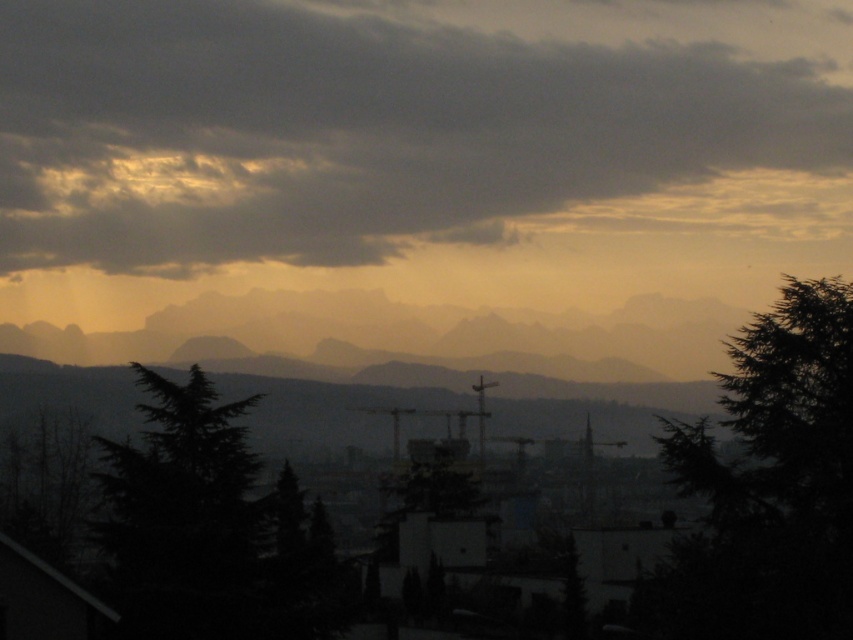
Describe the element at coordinates (403, 125) in the screenshot. I see `dark gray textured cloud at upper center` at that location.

Which of these two, dark gray textured cloud at upper center or green textured tree at right, stands taller?

With more height is dark gray textured cloud at upper center.

Which is in front, point (149, 68) or point (712, 552)?

Point (712, 552) is in front.

Find the location of `dark gray textured cloud at upper center`. dark gray textured cloud at upper center is located at coordinates (403, 125).